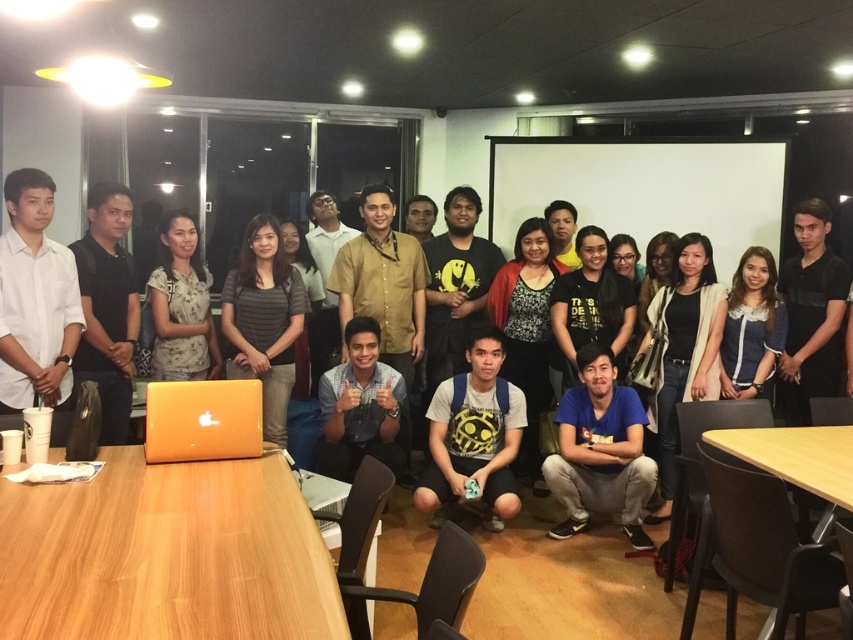
Question: Considering the real-world distances, which object is closest to the light brown printed blouse at center?

Choices:
 (A) blue denim shirt at upper right
 (B) black matte shirt at center

Answer: (B)

Question: Can you confirm if wooden table at lower left is thinner than matte black shirt at left?

Choices:
 (A) yes
 (B) no

Answer: (B)

Question: Based on their relative distances, which object is nearer to the matte black shirt at left?

Choices:
 (A) blue denim shirt at upper right
 (B) light brown printed blouse at center
 (C) matte black shirt at center

Answer: (B)

Question: Is yellow matte shirt at center below glossy yellow laptop at center?

Choices:
 (A) no
 (B) yes

Answer: (B)

Question: Is light brown wooden table at lower right wider than black matte shirt at center?

Choices:
 (A) no
 (B) yes

Answer: (B)

Question: Which point is closer to the camera taking this photo?

Choices:
 (A) (585, 230)
 (B) (206, 349)
 (C) (729, 291)

Answer: (B)